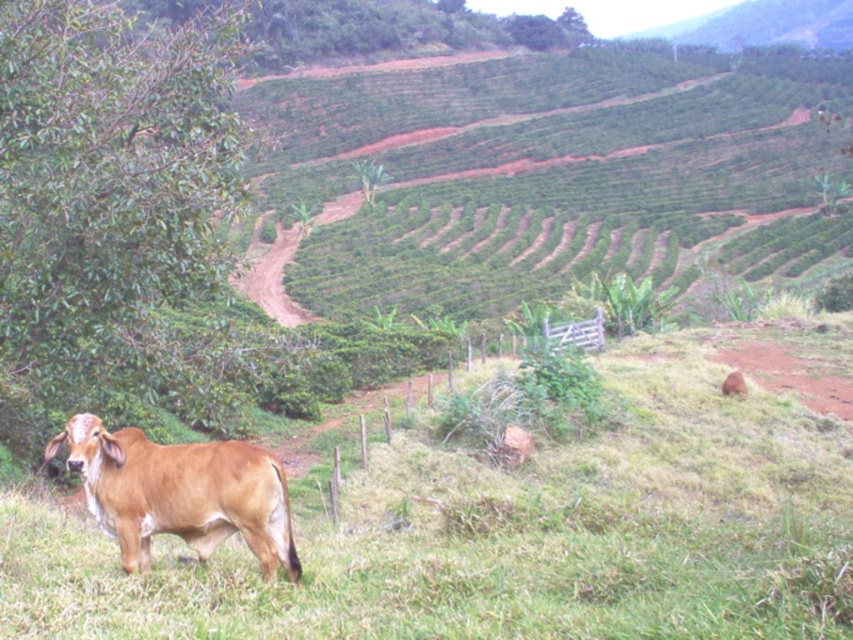
Question: Does green grassy at lower left appear on the left side of brown smooth cow at lower left?

Choices:
 (A) yes
 (B) no

Answer: (B)

Question: Considering the relative positions of green grassy at lower left and brown smooth cow at lower left in the image provided, where is green grassy at lower left located with respect to brown smooth cow at lower left?

Choices:
 (A) left
 (B) right

Answer: (B)

Question: Observing the image, what is the correct spatial positioning of green grassy at lower left in reference to brown smooth cow at lower left?

Choices:
 (A) right
 (B) left

Answer: (A)

Question: Which of the following is the closest to the observer?

Choices:
 (A) (308, 524)
 (B) (231, 445)

Answer: (B)